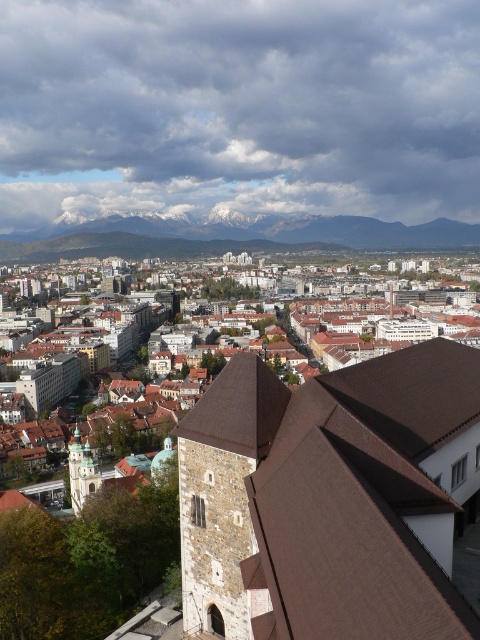
You are a city planner analyzing the rooftop space for solar panels. You observe the brown tiled roof at center and the golden stone tower at center. Which of these two structures has a greater potential for installing solar panels based on their width?

The brown tiled roof at center has a greater potential for installing solar panels because its width is larger than that of the golden stone tower at center, providing more surface area.

Based on the coordinates provided, which object in the scene is located at point (223, 490)?

The point (223, 490) marks the stone tower at center.